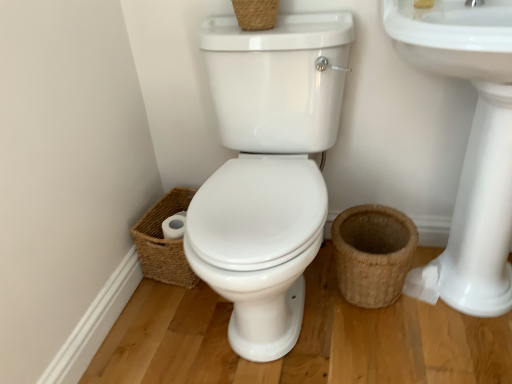
Question: Does woven brown basket at upper center, which is the 2th basket in right-to-left order, have a lesser height compared to woven brown basket at lower left, the 3th basket positioned from the right?

Choices:
 (A) yes
 (B) no

Answer: (A)

Question: Is woven brown basket at lower left, the second basket when ordered from bottom to top, at the back of woven brown basket at upper center, acting as the third basket starting from the bottom?

Choices:
 (A) no
 (B) yes

Answer: (A)

Question: Is woven brown basket at upper center, the 1th basket in the top-to-bottom sequence, outside of woven brown basket at lower left, acting as the second basket starting from the top?

Choices:
 (A) no
 (B) yes

Answer: (B)

Question: Is woven brown basket at upper center, the 1th basket in the top-to-bottom sequence, aimed at woven brown basket at lower left, the 3th basket positioned from the right?

Choices:
 (A) yes
 (B) no

Answer: (B)

Question: From a real-world perspective, does woven brown basket at upper center, acting as the third basket starting from the bottom, stand above woven brown basket at lower left, acting as the first basket starting from the left?

Choices:
 (A) yes
 (B) no

Answer: (A)

Question: From the image's perspective, is brown woven basket at lower right, which appears as the 3th basket when viewed from the left, located above or below woven brown basket at lower left, acting as the second basket starting from the top?

Choices:
 (A) above
 (B) below

Answer: (B)

Question: From a real-world perspective, relative to woven brown basket at lower left, acting as the first basket starting from the left, is brown woven basket at lower right, the first basket from the right, vertically above or below?

Choices:
 (A) below
 (B) above

Answer: (B)

Question: Based on their positions, is brown woven basket at lower right, which appears as the 3th basket when viewed from the left, located to the left or right of woven brown basket at lower left, acting as the second basket starting from the top?

Choices:
 (A) left
 (B) right

Answer: (B)

Question: In terms of height, does brown woven basket at lower right, which appears as the 3th basket when viewed from the left, look taller or shorter compared to woven brown basket at lower left, the second basket when ordered from bottom to top?

Choices:
 (A) tall
 (B) short

Answer: (A)

Question: Is white ceramic sink at right, positioned as the first sink in right-to-left order, situated inside white glossy sink at upper right, which appears as the second sink when viewed from the right, or outside?

Choices:
 (A) outside
 (B) inside

Answer: (A)

Question: From the image's perspective, is white ceramic sink at right, arranged as the 2th sink when viewed from the left, above or below white glossy sink at upper right, the first sink in the left-to-right sequence?

Choices:
 (A) below
 (B) above

Answer: (B)

Question: Is white ceramic sink at right, arranged as the 2th sink when viewed from the left, wider or thinner than white glossy sink at upper right, the first sink in the left-to-right sequence?

Choices:
 (A) wide
 (B) thin

Answer: (B)

Question: Is white ceramic sink at right, arranged as the 2th sink when viewed from the left, to the left or to the right of white glossy sink at upper right, which appears as the second sink when viewed from the right, in the image?

Choices:
 (A) left
 (B) right

Answer: (B)

Question: Does point (282, 188) appear closer or farther from the camera than point (270, 11)?

Choices:
 (A) farther
 (B) closer

Answer: (A)

Question: Relative to woven brown basket at upper center, which is the 2th basket in right-to-left order, is white glossy sink at upper right, the first sink in the left-to-right sequence, in front or behind?

Choices:
 (A) behind
 (B) front

Answer: (B)